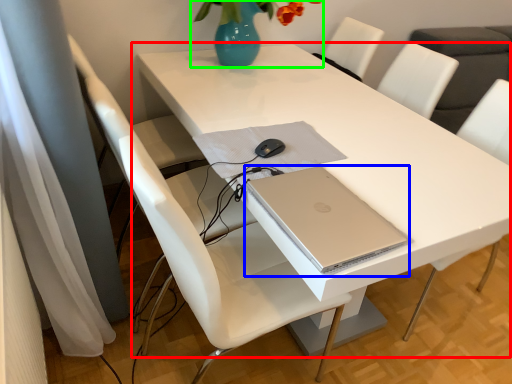
Question: Considering the real-world distances, which object is closest to table (highlighted by a red box)? computer (highlighted by a blue box) or floral arrangement (highlighted by a green box).

Choices:
 (A) computer
 (B) floral arrangement

Answer: (A)